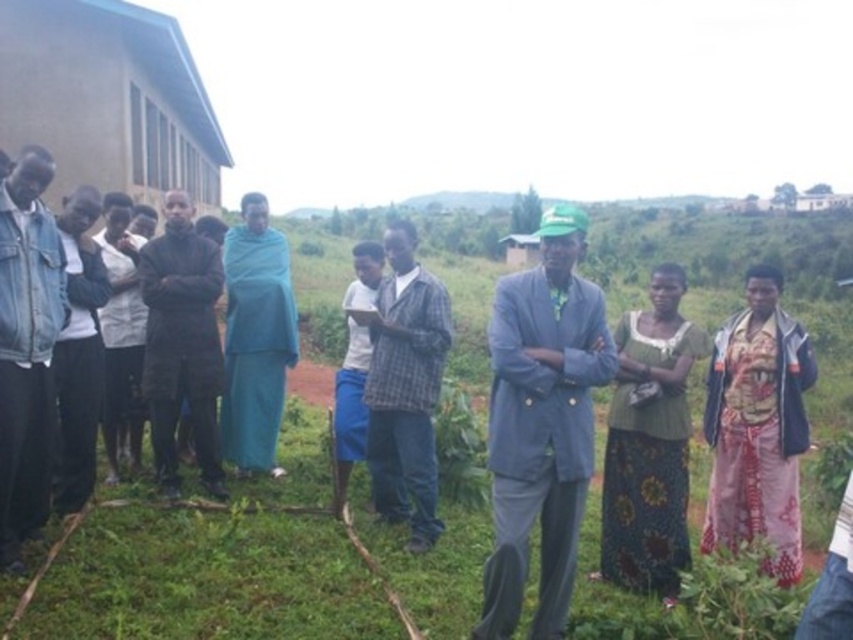
Question: Does denim jacket at left have a smaller size compared to plaid fabric shirt at center?

Choices:
 (A) yes
 (B) no

Answer: (B)

Question: Does light gray suit at center have a larger size compared to dark gray fabric jacket at left?

Choices:
 (A) no
 (B) yes

Answer: (B)

Question: Which point is closer to the camera taking this photo?

Choices:
 (A) (50, 461)
 (B) (396, 460)
 (C) (566, 596)
 (D) (169, 472)

Answer: (C)

Question: Which of the following is the farthest from the observer?

Choices:
 (A) (32, 420)
 (B) (514, 305)

Answer: (A)

Question: Is denim jacket at left closer to the viewer compared to dark gray fabric jacket at left?

Choices:
 (A) yes
 (B) no

Answer: (A)

Question: Estimate the real-world distances between objects in this image. Which object is closer to the light gray suit at center?

Choices:
 (A) plaid fabric shirt at center
 (B) dark gray fabric jacket at left

Answer: (A)